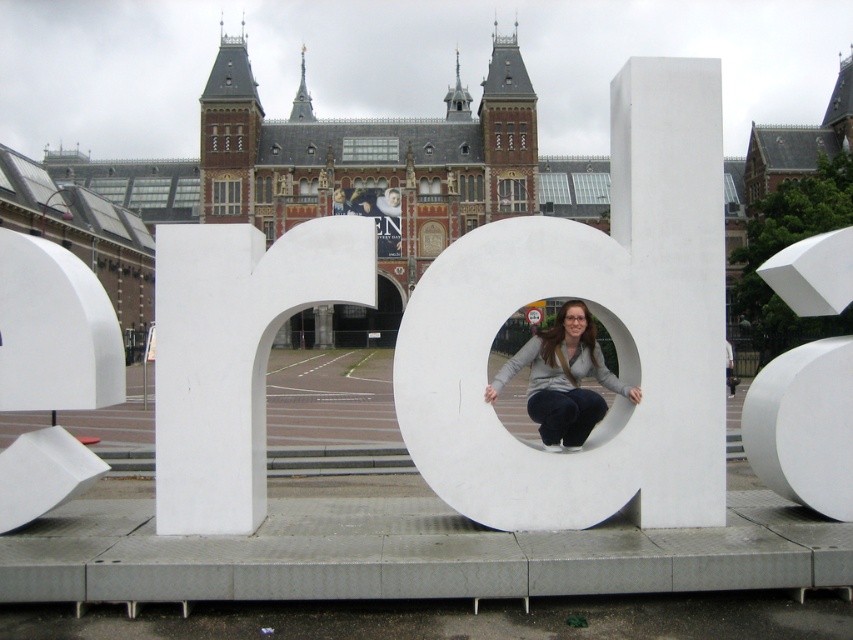
Question: Estimate the real-world distances between objects in this image. Which object is farther from the white matte sphere at right?

Choices:
 (A) matte gray sweater at center
 (B) white matte letter at center

Answer: (A)

Question: Which object is closer to the camera taking this photo?

Choices:
 (A) white matte sphere at right
 (B) white matte letter at center
 (C) matte gray sweater at center

Answer: (A)

Question: Where is white matte letter at center located in relation to matte gray sweater at center in the image?

Choices:
 (A) below
 (B) above

Answer: (B)

Question: Estimate the real-world distances between objects in this image. Which object is farther from the white matte letter at center?

Choices:
 (A) matte gray sweater at center
 (B) white matte sphere at right

Answer: (B)

Question: Does white matte letter at center appear over matte gray sweater at center?

Choices:
 (A) no
 (B) yes

Answer: (B)

Question: Does white matte sphere at right appear on the right side of matte gray sweater at center?

Choices:
 (A) yes
 (B) no

Answer: (A)